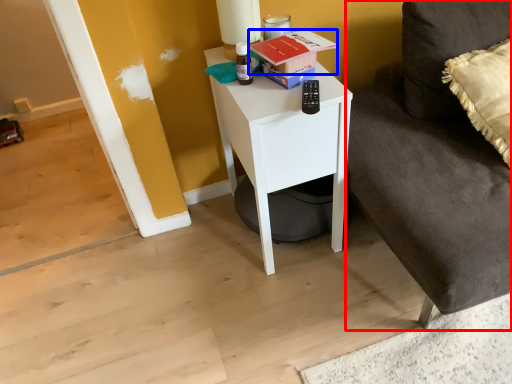
Question: Among these objects, which one is farthest to the camera, couch (highlighted by a red box) or book (highlighted by a blue box)?

Choices:
 (A) couch
 (B) book

Answer: (B)